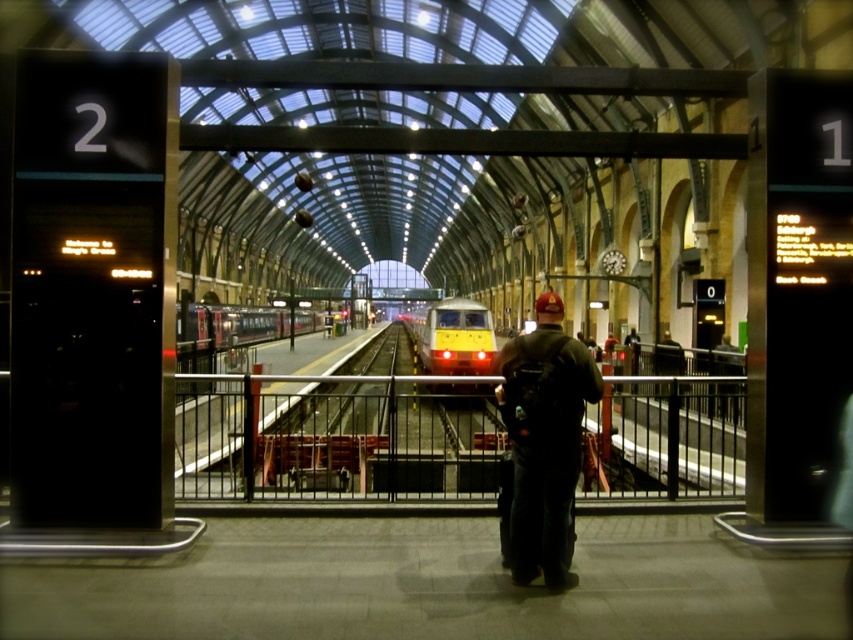
From the picture: Which is below, metallic rail at center or dark blue jeans at center?

Positioned lower is metallic rail at center.

Does metallic rail at center appear on the right side of dark blue jeans at center?

No, metallic rail at center is not to the right of dark blue jeans at center.

Does point (212, 403) lie in front of point (532, 520)?

That is False.

What are the coordinates of `metallic rail at center` in the screenshot? It's located at (335, 435).

This screenshot has width=853, height=640. Identify the location of yellow metallic train at center. (453, 337).

Who is more distant from viewer, (x=428, y=326) or (x=264, y=320)?

Positioned behind is point (x=264, y=320).

Where is `yellow metallic train at center`? yellow metallic train at center is located at coordinates (453, 337).

Is metallic rail at center thinner than silver metallic train at center?

No, metallic rail at center is not thinner than silver metallic train at center.

Does metallic rail at center appear over silver metallic train at center?

No.

Which is behind, point (740, 449) or point (236, 328)?

Point (236, 328)

Where is `metallic rail at center`? The height and width of the screenshot is (640, 853). metallic rail at center is located at coordinates (335, 435).